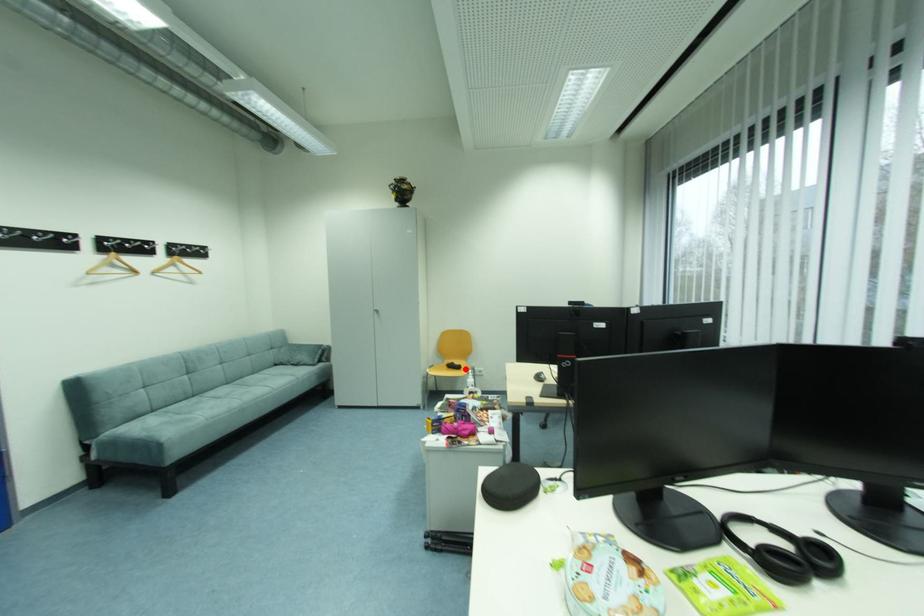
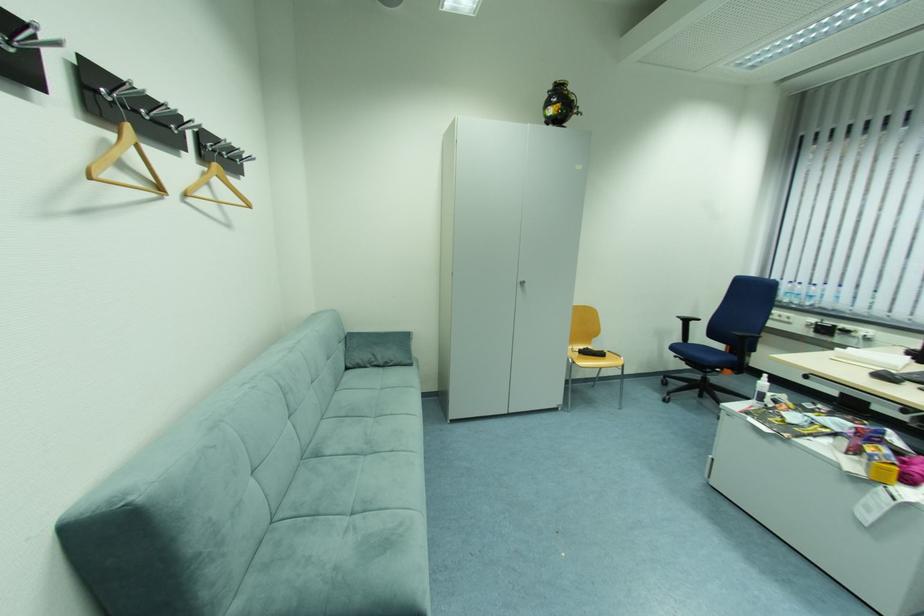
Question: I am providing you with two images of the same scene from different viewpoints. In image1, a red point is highlighted. Considering the same 3D point in image2, which of the following is correct?

Choices:
 (A) It is closer
 (B) It is farther

Answer: (A)